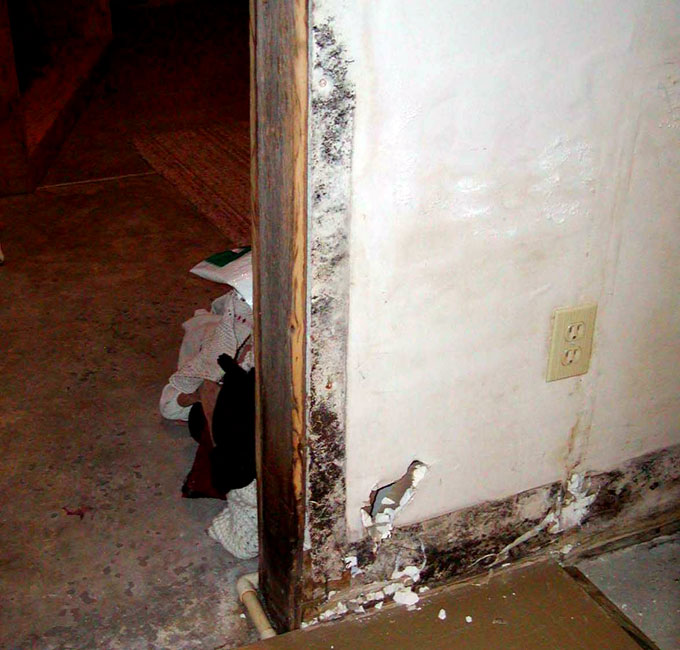
What are the coordinates of `carpet, grey with black border` in the screenshot? It's located at (630, 582).